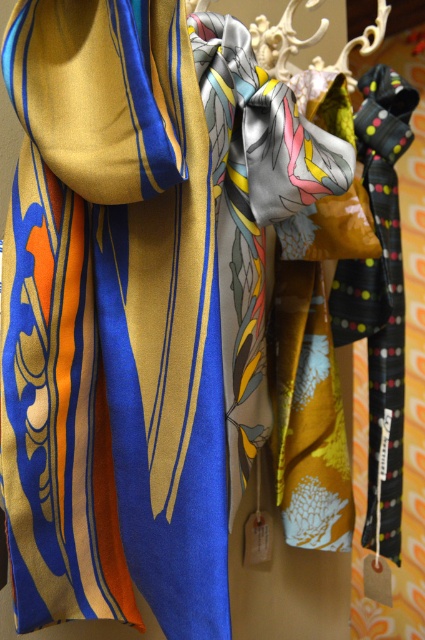
You are an interior designer arranging a display of scarves. You want to ensure that the silky striped scarf at left is positioned above the silky floral tie at center. Based on the current arrangement shown in the image, is this requirement met?

The silky striped scarf at left is below the silky floral tie at center, so the requirement is not met as it is currently positioned below rather than above.

You are a store employee arranging the scarves on the hanger. You need to ensure that the narrower scarf is placed on the right side of the wider one. Based on the current arrangement, is the silky floral tie at center positioned correctly to the right of the silky striped scarf at left?

The silky striped scarf at left is wider than the silky floral tie at center. Since the requirement is to place the narrower scarf on the right of the wider one, the silky floral tie at center is correctly positioned to the right of the silky striped scarf at left.